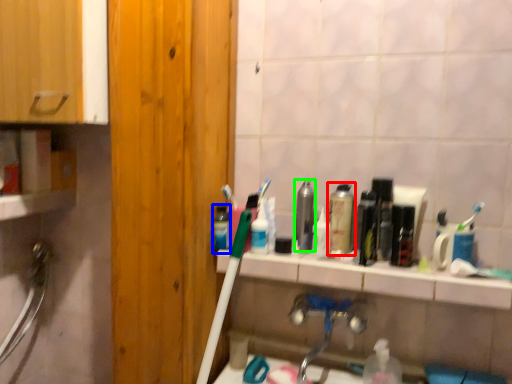
Question: Which object is positioned farthest from mouthwash (highlighted by a red box)? Select from mouthwash (highlighted by a blue box) and mouthwash (highlighted by a green box).

Choices:
 (A) mouthwash
 (B) mouthwash

Answer: (A)